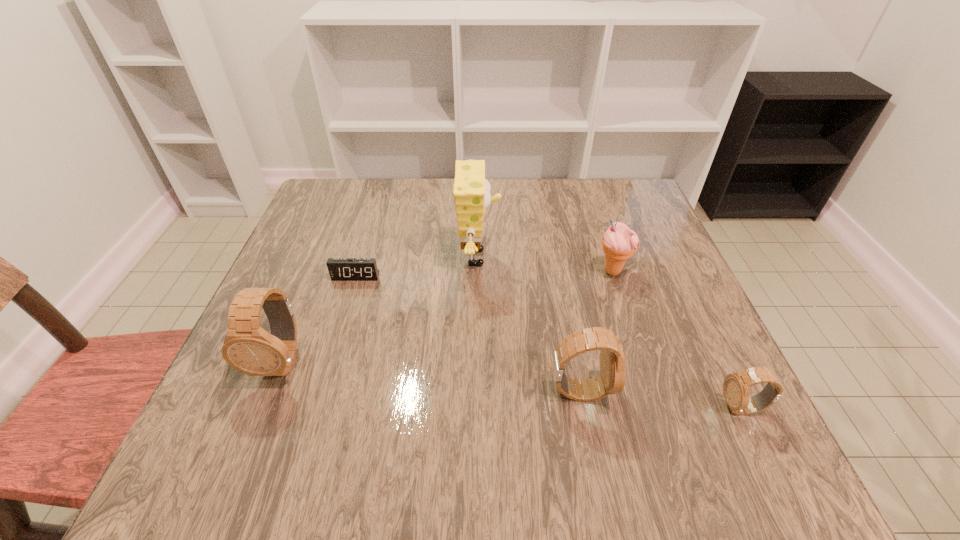
Locate an element on the screen. Image resolution: width=960 pixels, height=540 pixels. vacant space located on the face of the fourth object from left to right is located at coordinates (710, 392).

Locate an element on the screen. This screenshot has height=540, width=960. vacant area located 0.390m on the face of the rightmost watch is located at coordinates (493, 408).

Where is `vacant region located 0.190m on the face of the rightmost watch`? The height and width of the screenshot is (540, 960). vacant region located 0.190m on the face of the rightmost watch is located at coordinates (611, 408).

The image size is (960, 540). I want to click on free space located 0.300m on the face of the rightmost watch, so pyautogui.click(x=546, y=408).

The image size is (960, 540). I want to click on vacant region located on the left of the icecream, so click(446, 271).

You are a GUI agent. You are given a task and a screenshot of the screen. Output one action in this format:
    pyautogui.click(x=<x>, y=<y>)
    Task: Click on the free spot located on the front-facing side of the tallest object
    
    Given the screenshot: What is the action you would take?
    [613, 258]

The width and height of the screenshot is (960, 540). I want to click on vacant space located 0.280m on the front-facing side of the shortest object, so click(x=322, y=390).

Identify the location of object situated at the far edge. The height and width of the screenshot is (540, 960). (471, 191).

This screenshot has height=540, width=960. I want to click on watch at the left edge, so click(x=247, y=347).

Where is `alarm clock that is at the left edge`? This screenshot has height=540, width=960. alarm clock that is at the left edge is located at coordinates (340, 269).